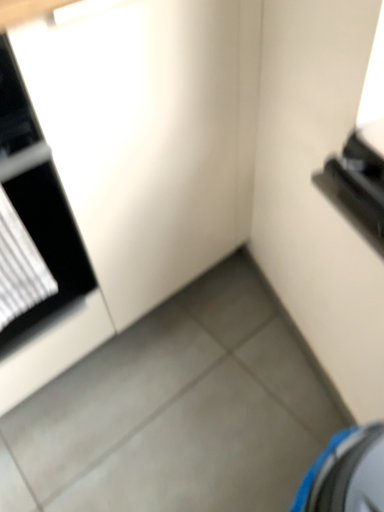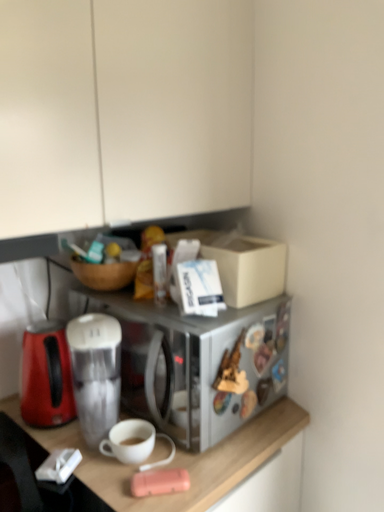
Question: Which way did the camera rotate in the video?

Choices:
 (A) rotated downward
 (B) rotated upward

Answer: (B)